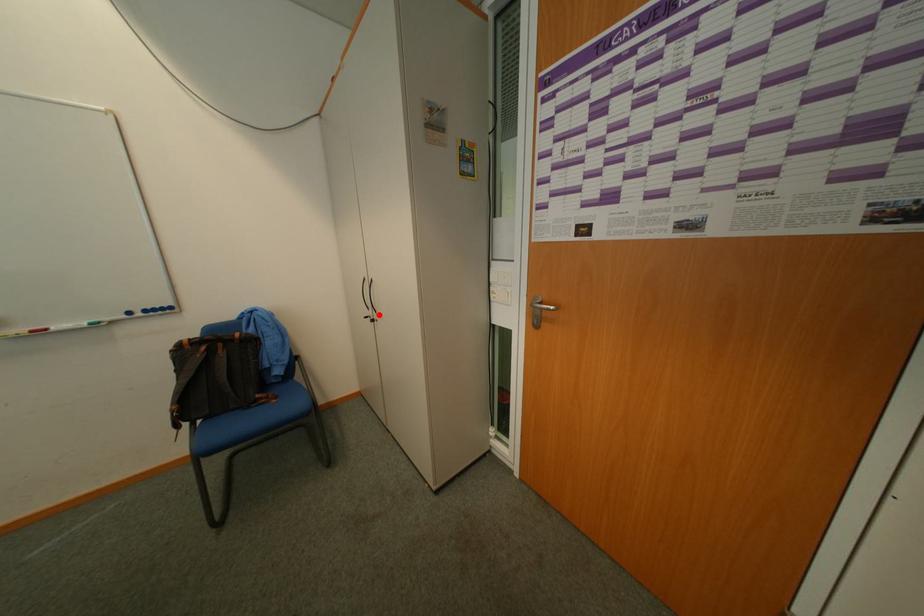
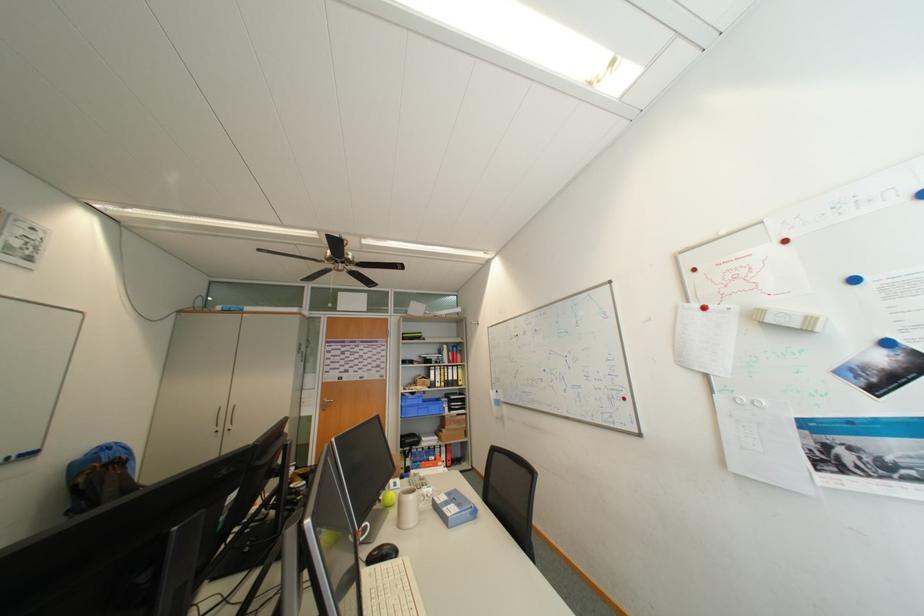
Question: I am providing you with two images of the same scene from different viewpoints. A red point is marked on the first image. Is the red point's position out of view in image 2?

Choices:
 (A) Yes
 (B) No

Answer: (B)